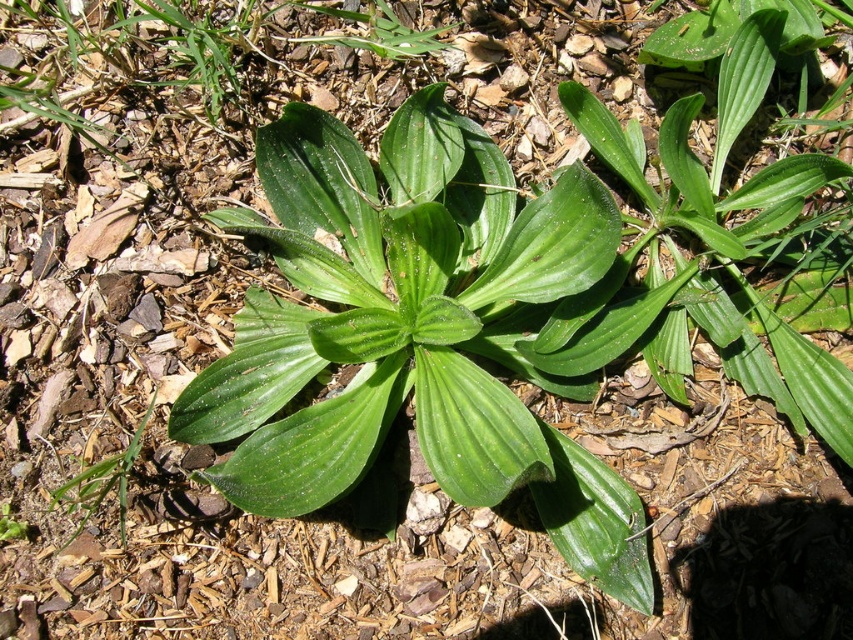
Who is more forward, (514, 445) or (64, 483)?

Point (514, 445) is in front.

Does green matte leafy plant at center appear on the right side of green leafy plant at lower left?

Yes, green matte leafy plant at center is to the right of green leafy plant at lower left.

Image resolution: width=853 pixels, height=640 pixels. What do you see at coordinates (410, 330) in the screenshot? I see `green matte leafy plant at center` at bounding box center [410, 330].

I want to click on green matte leafy plant at center, so click(410, 330).

Does green matte leafy plant at center lie behind green glossy leaf at center?

That is False.

Who is positioned more to the right, green matte leafy plant at center or green glossy leaf at center?

green glossy leaf at center is more to the right.

Locate an element on the screen. green matte leafy plant at center is located at coordinates (410, 330).

Find the location of a particular element. The width and height of the screenshot is (853, 640). green matte leafy plant at center is located at coordinates (410, 330).

Can you confirm if green glossy leaf at center is positioned above green leafy plant at lower left?

Yes.

Is green glossy leaf at center thinner than green leafy plant at lower left?

No.

You are a GUI agent. You are given a task and a screenshot of the screen. Output one action in this format:
    pyautogui.click(x=<x>, y=<y>)
    Task: Click on the green glossy leaf at center
    
    Given the screenshot: What is the action you would take?
    pyautogui.click(x=720, y=248)